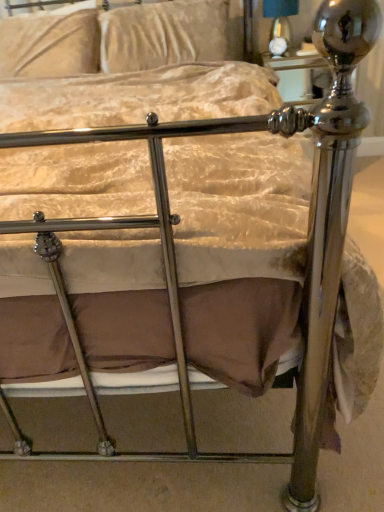
This screenshot has height=512, width=384. Find the location of `velvet beige pillow at upper left, the second pillow viewed from the right`. velvet beige pillow at upper left, the second pillow viewed from the right is located at coordinates (49, 44).

This screenshot has height=512, width=384. What do you see at coordinates (163, 34) in the screenshot?
I see `velvet beige pillow at upper center, which is the first pillow in right-to-left order` at bounding box center [163, 34].

The image size is (384, 512). I want to click on velvet beige pillow at upper left, the second pillow viewed from the right, so click(49, 44).

Is velvet beige pillow at upper left, the second pillow viewed from the right, oriented towards velvet beige pillow at upper center, which is the first pillow in right-to-left order?

No, velvet beige pillow at upper left, the second pillow viewed from the right, does not turn towards velvet beige pillow at upper center, which is the first pillow in right-to-left order.

Where is `pillow that is on the right side of velvet beige pillow at upper left, which appears as the first pillow when viewed from the left`? The height and width of the screenshot is (512, 384). pillow that is on the right side of velvet beige pillow at upper left, which appears as the first pillow when viewed from the left is located at coordinates (163, 34).

Who is bigger, velvet beige pillow at upper left, the second pillow viewed from the right, or velvet beige pillow at upper center, which is the first pillow in right-to-left order?

velvet beige pillow at upper left, the second pillow viewed from the right, is bigger.

From a real-world perspective, is velvet beige pillow at upper left, which appears as the first pillow when viewed from the left, on top of velvet beige pillow at upper center, which is the first pillow in right-to-left order?

Yes, from a real-world perspective, velvet beige pillow at upper left, which appears as the first pillow when viewed from the left, is over velvet beige pillow at upper center, which is the first pillow in right-to-left order

Based on the photo, from the image's perspective, which is above, velvet beige pillow at upper center, the 2th pillow positioned from the left, or matte black lampshade at upper center?

matte black lampshade at upper center appears higher in the image.

From a real-world perspective, is velvet beige pillow at upper center, the 2th pillow positioned from the left, located beneath matte black lampshade at upper center?

Incorrect, from a real-world perspective, velvet beige pillow at upper center, the 2th pillow positioned from the left, is higher than matte black lampshade at upper center.

Is matte black lampshade at upper center at the back of velvet beige pillow at upper center, which is the first pillow in right-to-left order?

No, velvet beige pillow at upper center, which is the first pillow in right-to-left order,'s orientation is not away from matte black lampshade at upper center.

This screenshot has height=512, width=384. Identify the location of pillow that is the 1st object to the left of the matte black lampshade at upper center, starting at the anchor. (163, 34).

Considering the sizes of objects matte black lampshade at upper center and velvet beige pillow at upper left, which appears as the first pillow when viewed from the left, in the image provided, who is wider, matte black lampshade at upper center or velvet beige pillow at upper left, which appears as the first pillow when viewed from the left,?

With larger width is velvet beige pillow at upper left, which appears as the first pillow when viewed from the left.

Which pillow is the 2nd one when counting from the left side of the matte black lampshade at upper center? Please provide its 2D coordinates.

[(49, 44)]

From the image's perspective, between matte black lampshade at upper center and velvet beige pillow at upper left, the second pillow viewed from the right, which one is located above?

matte black lampshade at upper center appears higher in the image.

Which is in front, velvet beige pillow at upper left, the second pillow viewed from the right, or matte black lampshade at upper center?

velvet beige pillow at upper left, the second pillow viewed from the right, is closer to the camera.

Could you tell me if velvet beige pillow at upper left, which appears as the first pillow when viewed from the left, is turned towards matte black lampshade at upper center?

No, velvet beige pillow at upper left, which appears as the first pillow when viewed from the left, is not facing towards matte black lampshade at upper center.

In the image, is velvet beige pillow at upper left, the second pillow viewed from the right, on the left side or the right side of matte black lampshade at upper center?

Based on their positions, velvet beige pillow at upper left, the second pillow viewed from the right, is located to the left of matte black lampshade at upper center.

Is velvet beige pillow at upper left, which appears as the first pillow when viewed from the left, shorter than matte black lampshade at upper center?

No, velvet beige pillow at upper left, which appears as the first pillow when viewed from the left, is not shorter than matte black lampshade at upper center.

Where is `table lamp behind the velvet beige pillow at upper center, the 2th pillow positioned from the left`? The width and height of the screenshot is (384, 512). table lamp behind the velvet beige pillow at upper center, the 2th pillow positioned from the left is located at coordinates (280, 24).

Which is more to the left, matte black lampshade at upper center or velvet beige pillow at upper center, the 2th pillow positioned from the left?

velvet beige pillow at upper center, the 2th pillow positioned from the left.

Is velvet beige pillow at upper center, which is the first pillow in right-to-left order, at the back of matte black lampshade at upper center?

matte black lampshade at upper center does not have its back to velvet beige pillow at upper center, which is the first pillow in right-to-left order.

Does velvet beige pillow at upper center, which is the first pillow in right-to-left order, appear on the left side of velvet beige pillow at upper left, the second pillow viewed from the right?

Incorrect, velvet beige pillow at upper center, which is the first pillow in right-to-left order, is not on the left side of velvet beige pillow at upper left, the second pillow viewed from the right.

Which object is wider, velvet beige pillow at upper center, which is the first pillow in right-to-left order, or velvet beige pillow at upper left, the second pillow viewed from the right?

With larger width is velvet beige pillow at upper left, the second pillow viewed from the right.

From the picture: Can velvet beige pillow at upper left, which appears as the first pillow when viewed from the left, be found inside velvet beige pillow at upper center, which is the first pillow in right-to-left order?

Definitely not — velvet beige pillow at upper left, which appears as the first pillow when viewed from the left, is not inside velvet beige pillow at upper center, which is the first pillow in right-to-left order.

From a real-world perspective, does velvet beige pillow at upper center, which is the first pillow in right-to-left order, stand above velvet beige pillow at upper left, the second pillow viewed from the right?

Actually, velvet beige pillow at upper center, which is the first pillow in right-to-left order, is physically below velvet beige pillow at upper left, the second pillow viewed from the right, in the real world.

In the image, there is a velvet beige pillow at upper left, the second pillow viewed from the right. At what (x,y) coordinates should I click in order to perform the action: click on pillow below it (from a real-world perspective). Please return your answer as a coordinate pair (x, y). The image size is (384, 512). Looking at the image, I should click on (163, 34).

Locate an element on the screen. The height and width of the screenshot is (512, 384). table lamp lying on the right of velvet beige pillow at upper center, the 2th pillow positioned from the left is located at coordinates (280, 24).

From the image, which object appears to be nearer to velvet beige pillow at upper center, which is the first pillow in right-to-left order, matte black lampshade at upper center or velvet beige pillow at upper left, which appears as the first pillow when viewed from the left?

Among the two, velvet beige pillow at upper left, which appears as the first pillow when viewed from the left, is located nearer to velvet beige pillow at upper center, which is the first pillow in right-to-left order.

When comparing their distances from velvet beige pillow at upper left, the second pillow viewed from the right, does velvet beige pillow at upper center, the 2th pillow positioned from the left, or matte black lampshade at upper center seem closer?

velvet beige pillow at upper center, the 2th pillow positioned from the left, lies closer to velvet beige pillow at upper left, the second pillow viewed from the right, than the other object.

Based on their spatial positions, is velvet beige pillow at upper left, the second pillow viewed from the right, or matte black lampshade at upper center further from velvet beige pillow at upper center, the 2th pillow positioned from the left?

matte black lampshade at upper center lies further to velvet beige pillow at upper center, the 2th pillow positioned from the left, than the other object.

When comparing their distances from velvet beige pillow at upper left, the second pillow viewed from the right, does matte black lampshade at upper center or velvet beige pillow at upper center, which is the first pillow in right-to-left order, seem further?

The object further to velvet beige pillow at upper left, the second pillow viewed from the right, is matte black lampshade at upper center.

Estimate the real-world distances between objects in this image. Which object is closer to matte black lampshade at upper center, velvet beige pillow at upper center, the 2th pillow positioned from the left, or velvet beige pillow at upper left, which appears as the first pillow when viewed from the left?

The object closer to matte black lampshade at upper center is velvet beige pillow at upper center, the 2th pillow positioned from the left.

Looking at the image, which one is located closer to matte black lampshade at upper center, velvet beige pillow at upper left, the second pillow viewed from the right, or velvet beige pillow at upper center, the 2th pillow positioned from the left?

Based on the image, velvet beige pillow at upper center, the 2th pillow positioned from the left, appears to be nearer to matte black lampshade at upper center.

The image size is (384, 512). In order to click on pillow between velvet beige pillow at upper left, the second pillow viewed from the right, and matte black lampshade at upper center in this screenshot , I will do `click(163, 34)`.